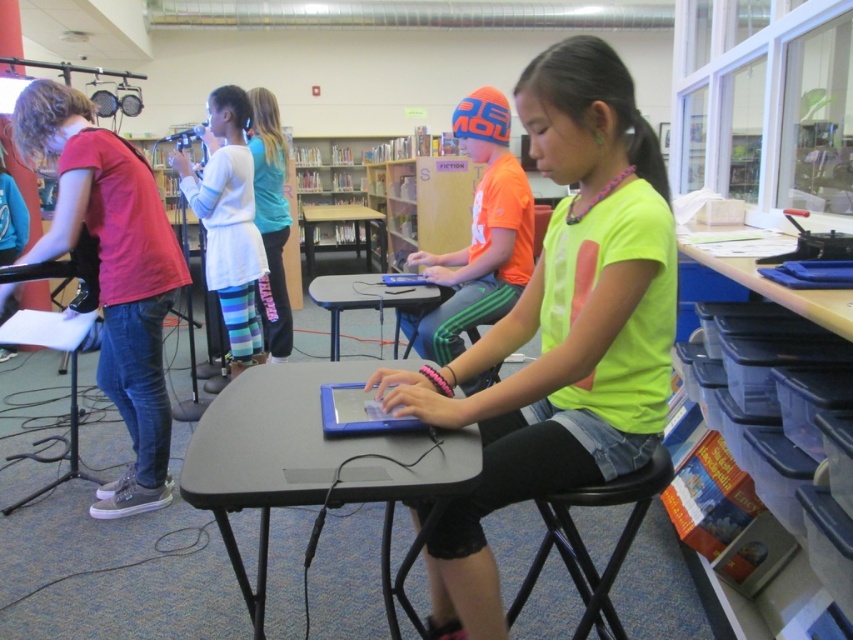
You are a teacher in the library and need to pass between the matte red shirt at left and the orange matte shirt at center to reach the supply closet. Can you walk through the space between them without needing to move either child?

The distance between the matte red shirt at left and orange matte shirt at center is 3.58 feet, which is sufficient for a person to walk through comfortably without needing to move either child.

You are a photographer standing at the camera position. You want to take a photo of the gray plastic table at center. Is the table within your camera frame?

The gray plastic table at center is 3.47 feet from camera, which is within the typical camera frame distance, so yes, the table is within your camera frame.